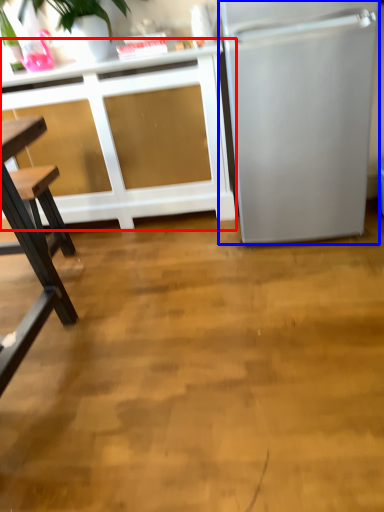
Question: Which point is closer to the camera, cabinetry (highlighted by a red box) or refrigerator (highlighted by a blue box)?

Choices:
 (A) cabinetry
 (B) refrigerator

Answer: (B)